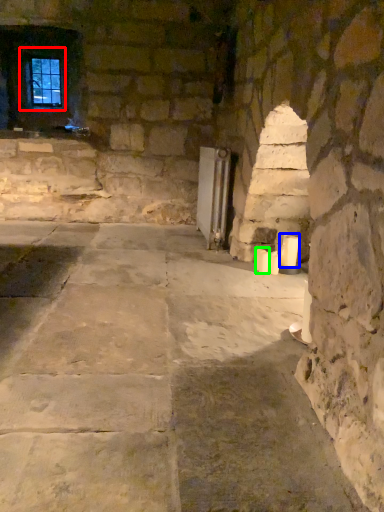
Question: Based on their relative distances, which object is nearer to window (highlighted by a red box)? Choose from candle (highlighted by a blue box) and candle (highlighted by a green box).

Choices:
 (A) candle
 (B) candle

Answer: (B)